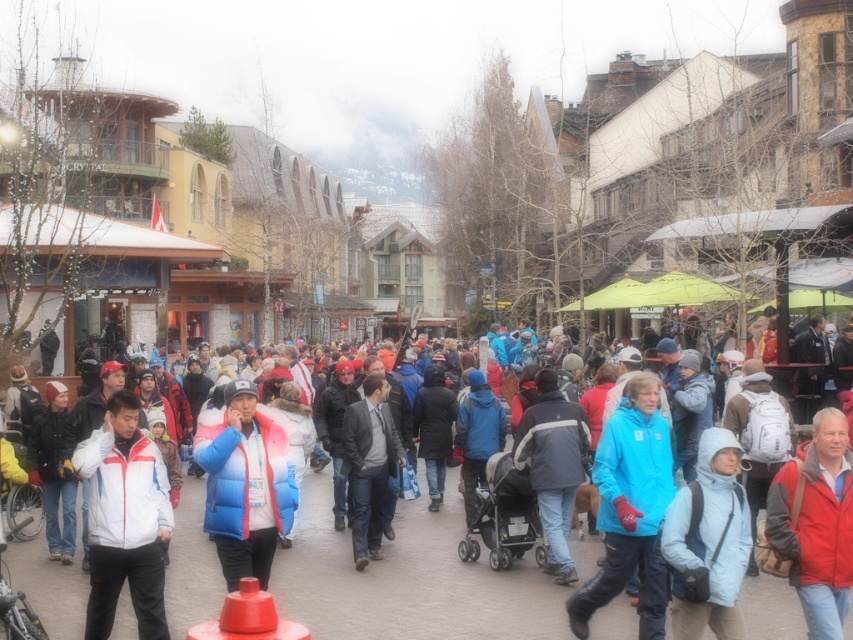
Who is more forward, (641, 388) or (817, 508)?

Point (817, 508)

Where is `blue matte jacket at center`? This screenshot has height=640, width=853. blue matte jacket at center is located at coordinates (630, 508).

Is white matte jacket at center below blue/pink puffer jacket at center?

Yes.

Does point (120, 557) come farther from viewer compared to point (223, 518)?

No, (120, 557) is closer to viewer.

Identify the location of white matte jacket at center. The height and width of the screenshot is (640, 853). (125, 518).

Is white matte jacket at center to the left of smooth plastic cone at lower center from the viewer's perspective?

Result: Yes, white matte jacket at center is to the left of smooth plastic cone at lower center.

Describe the element at coordinates (125, 518) in the screenshot. I see `white matte jacket at center` at that location.

Where is `white matte jacket at center`? The height and width of the screenshot is (640, 853). white matte jacket at center is located at coordinates (125, 518).